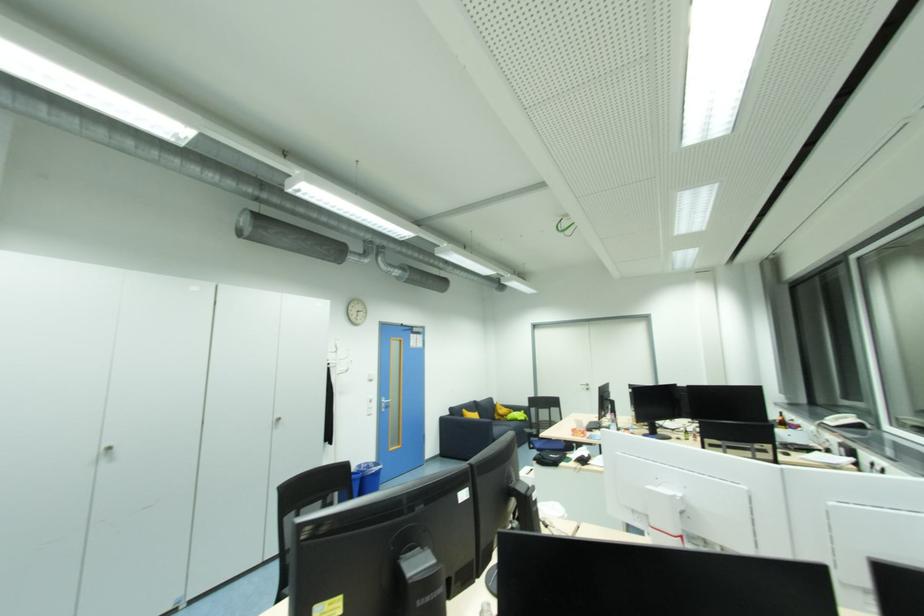
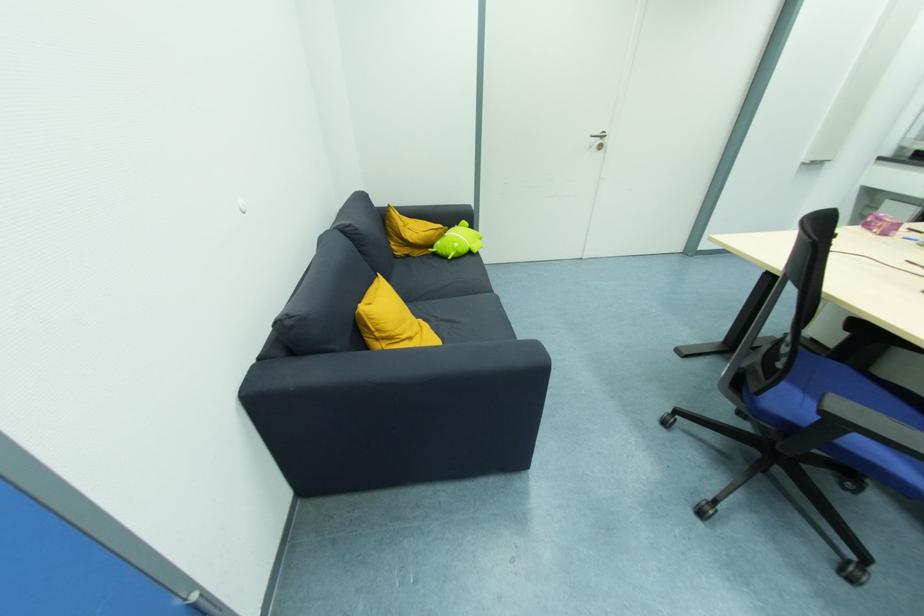
Where in the second image is the point corresponding to (500,418) from the first image?

(403, 253)